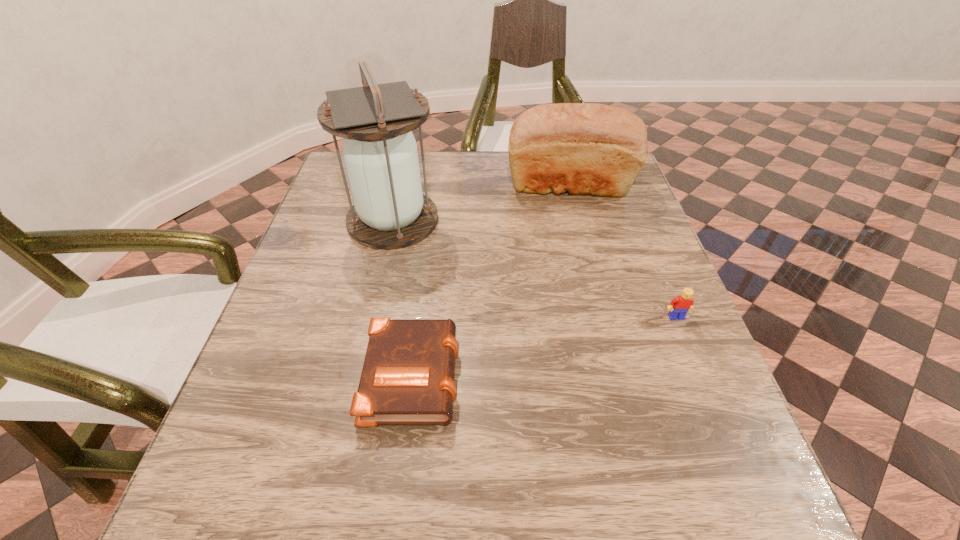
Identify the location of lantern at the far edge. (390, 211).

In order to click on bread at the far edge in this screenshot , I will do pos(584,148).

The width and height of the screenshot is (960, 540). What are the coordinates of `object at the left edge` in the screenshot? It's located at (390, 211).

This screenshot has height=540, width=960. Identify the location of bread that is at the right edge. (584, 148).

Image resolution: width=960 pixels, height=540 pixels. Identify the location of Lego that is positioned at the right edge. (679, 306).

I want to click on object at the far left corner, so click(x=390, y=211).

Image resolution: width=960 pixels, height=540 pixels. What are the coordinates of `object that is at the far right corner` in the screenshot? It's located at (584, 148).

The height and width of the screenshot is (540, 960). Find the location of `free space at the far edge of the desktop`. free space at the far edge of the desktop is located at coordinates (457, 190).

This screenshot has width=960, height=540. In the image, there is a desktop. Find the location of `free space at the left edge`. free space at the left edge is located at coordinates (331, 248).

The width and height of the screenshot is (960, 540). Identify the location of free point at the right edge. (604, 204).